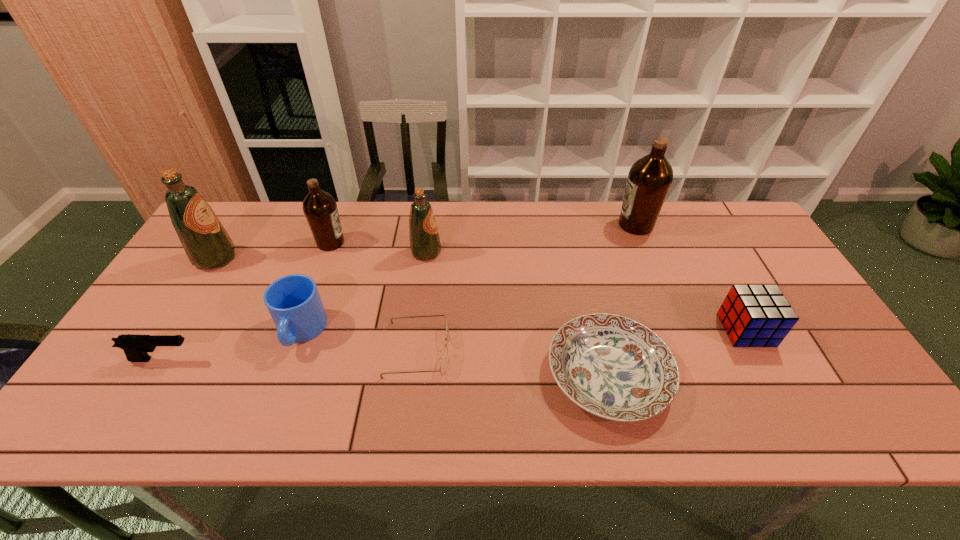
Identify the location of vacant region located 0.140m on the label of the smaller brown olive oil. The image size is (960, 540). (391, 242).

Identify the location of free spot located 0.050m on the side of the mug with the handle. The image size is (960, 540). 285,376.

Where is `blank space located 0.330m on the left of the rightmost object`? The width and height of the screenshot is (960, 540). blank space located 0.330m on the left of the rightmost object is located at coordinates (596, 330).

You are a GUI agent. You are given a task and a screenshot of the screen. Output one action in this format:
    pyautogui.click(x=<x>, y=<y>)
    Task: Click on the vacant space located 0.200m on the front-facing side of the pistol
    The width and height of the screenshot is (960, 540).
    Given the screenshot: What is the action you would take?
    pyautogui.click(x=279, y=360)

Image resolution: width=960 pixels, height=540 pixels. Find the location of `vacant space located 0.310m on the front-facing side of the spectacles`. vacant space located 0.310m on the front-facing side of the spectacles is located at coordinates (574, 350).

Find the location of a particular element. vacant space located on the back of the plate is located at coordinates (582, 263).

Find the location of a particular element. object positioned at the near edge is located at coordinates click(614, 367).

This screenshot has height=540, width=960. I want to click on olive oil that is at the left edge, so 207,244.

You are a GUI agent. You are given a task and a screenshot of the screen. Output one action in this format:
    pyautogui.click(x=<x>, y=<y>)
    Task: Click on the pistol situated at the left edge
    The width and height of the screenshot is (960, 540).
    Given the screenshot: What is the action you would take?
    pyautogui.click(x=135, y=347)

Where is `object that is at the right edge`? This screenshot has width=960, height=540. object that is at the right edge is located at coordinates (752, 315).